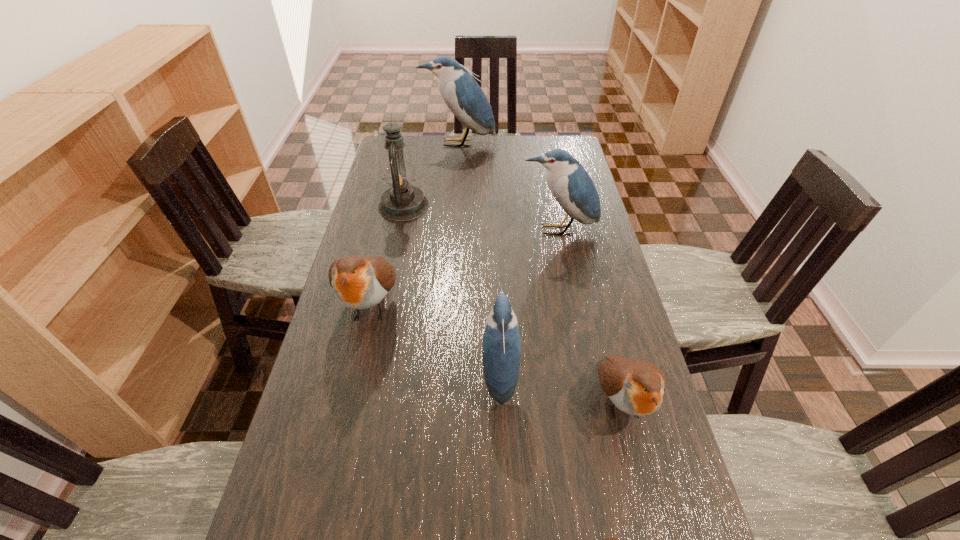
Where is `the farthest blue bird`? The width and height of the screenshot is (960, 540). the farthest blue bird is located at coordinates (462, 94).

Where is `the tallest bird`? the tallest bird is located at coordinates (462, 94).

Where is `oil lamp`? oil lamp is located at coordinates (402, 202).

The image size is (960, 540). What are the coordinates of `the fifth nearest bird` in the screenshot? It's located at (570, 184).

The image size is (960, 540). I want to click on the second nearest blue bird, so click(x=570, y=184).

This screenshot has width=960, height=540. Identify the location of the leftmost brown bird. (359, 282).

Where is `the biggest brown bird`? the biggest brown bird is located at coordinates (359, 282).

Find the location of a particular element. The height and width of the screenshot is (540, 960). the nearest blue bird is located at coordinates (501, 348).

This screenshot has height=540, width=960. What are the coordinates of `the second biggest brown bird` in the screenshot? It's located at [x=636, y=387].

The image size is (960, 540). Find the location of `the second nearest brown bird`. the second nearest brown bird is located at coordinates (636, 387).